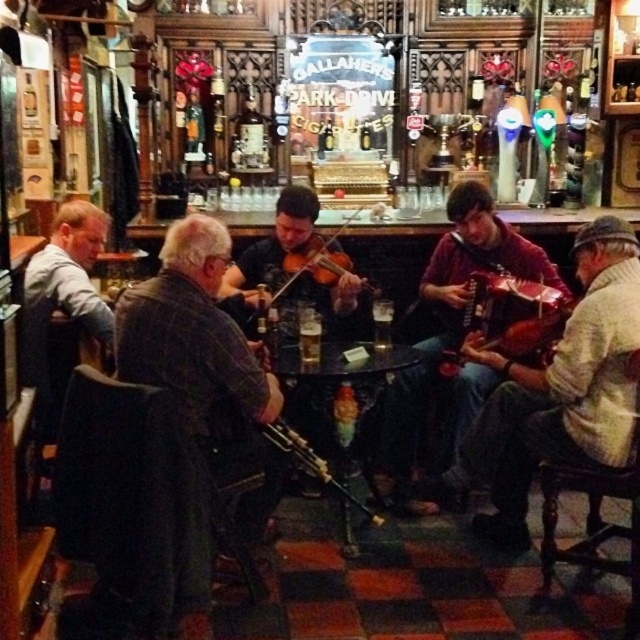
You are a photographer trying to capture a candid shot of the wooden bagpipe at center without including the gray wool sweater at left in the frame. Given their relative heights, is this possible?

The gray wool sweater at left is taller than the wooden bagpipe at center. Since the sweater is taller, it might block the view of the bagpipe if positioned between the photographer and the bagpipe. To avoid including the sweater, the photographer should position themselves so the bagpipe is not behind the sweater or adjust the angle to ensure the shorter bagpipe is framed without the taller sweater obstructing it.

You are a photographer setting up for a closeup shot of the wooden violin at center and wooden bagpipe at center. Which instrument should you focus on first if you want to capture both in a single frame without moving the camera, considering their sizes?

The wooden violin at center is larger in width than the wooden bagpipe at center, so focusing on the wooden violin at center first would allow you to frame both instruments effectively given their size difference.